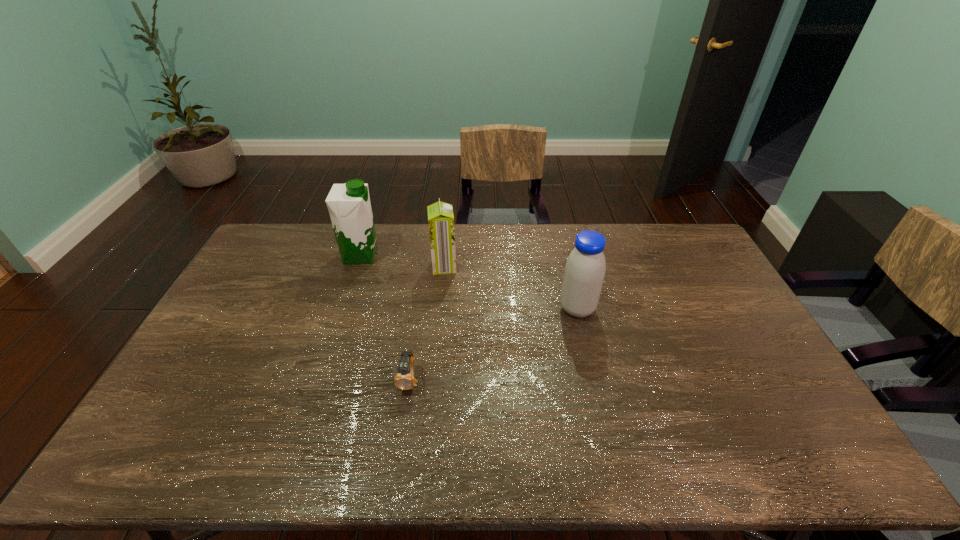
This screenshot has height=540, width=960. In order to click on the leftmost soya milk in this screenshot , I will do `click(349, 206)`.

Locate an element on the screen. The image size is (960, 540). the rightmost soya milk is located at coordinates (585, 268).

The height and width of the screenshot is (540, 960). What are the coordinates of `the rightmost object` in the screenshot? It's located at (585, 268).

Identify the location of the second soya milk from right to left. The height and width of the screenshot is (540, 960). (440, 215).

You are a GUI agent. You are given a task and a screenshot of the screen. Output one action in this format:
    pyautogui.click(x=<x>, y=<y>)
    Task: Click on the watch
    The width and height of the screenshot is (960, 540).
    Given the screenshot: What is the action you would take?
    pyautogui.click(x=405, y=380)

You are a GUI agent. You are given a task and a screenshot of the screen. Output one action in this format:
    pyautogui.click(x=<x>, y=<y>)
    Task: Click on the shortest object
    The width and height of the screenshot is (960, 540).
    Given the screenshot: What is the action you would take?
    pyautogui.click(x=405, y=380)

Find the location of a particular element. free spot located 0.190m on the front-facing side of the leftmost object is located at coordinates (430, 255).

Identify the location of free location located 0.180m on the left of the rightmost soya milk. The height and width of the screenshot is (540, 960). (503, 309).

Image resolution: width=960 pixels, height=540 pixels. Find the location of `free region located 0.320m on the front of the second soya milk from left to right`. free region located 0.320m on the front of the second soya milk from left to right is located at coordinates (437, 345).

The image size is (960, 540). Find the location of `free space located on the face of the shortest object`. free space located on the face of the shortest object is located at coordinates (398, 456).